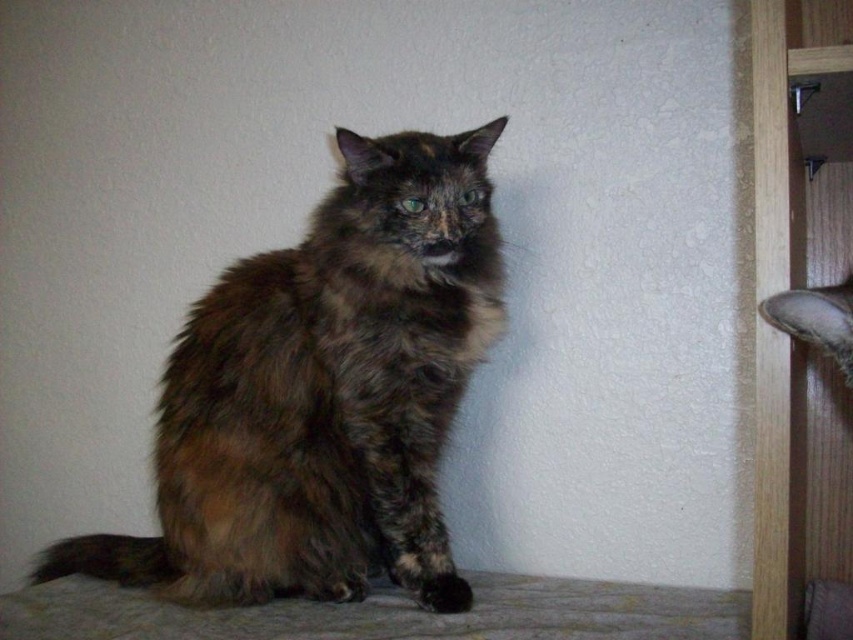
Question: Among these objects, which one is nearest to the camera?

Choices:
 (A) brown shaggy cat at right
 (B) brown fur cat at center

Answer: (A)

Question: Which point is closer to the camera?

Choices:
 (A) brown fur cat at center
 (B) brown shaggy cat at right

Answer: (B)

Question: Can you confirm if brown fur cat at center is bigger than brown shaggy cat at right?

Choices:
 (A) yes
 (B) no

Answer: (A)

Question: Does brown fur cat at center appear on the right side of brown shaggy cat at right?

Choices:
 (A) yes
 (B) no

Answer: (B)

Question: Where is brown fur cat at center located in relation to brown shaggy cat at right in the image?

Choices:
 (A) below
 (B) above

Answer: (A)